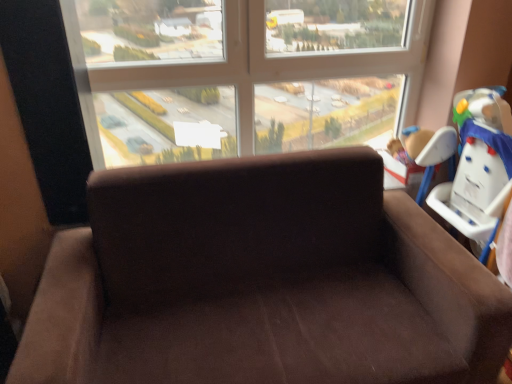
From the picture: In order to face white plastic baby carriage at right, should I rotate leftwards or rightwards?

It's best to rotate right around 27.843 degrees.

Image resolution: width=512 pixels, height=384 pixels. Identify the location of transparent glass window at upper center. (250, 66).

From the image's perspective, who appears lower, white plastic baby carriage at right or brown plush toy at upper right?

white plastic baby carriage at right appears lower in the image.

Can you confirm if white plastic baby carriage at right is positioned to the right of brown plush toy at upper right?

Yes.

Is white plastic baby carriage at right directly adjacent to brown plush toy at upper right?

No, white plastic baby carriage at right is not touching brown plush toy at upper right.

In the image, is white plastic baby carriage at right positioned in front of or behind brown plush toy at upper right?

In the image, white plastic baby carriage at right appears in front of brown plush toy at upper right.

From a real-world perspective, is suede brown couch at center physically located above or below brown plush toy at upper right?

suede brown couch at center is below brown plush toy at upper right.

Considering the positions of objects suede brown couch at center and brown plush toy at upper right in the image provided, who is more to the right, suede brown couch at center or brown plush toy at upper right?

brown plush toy at upper right.

Based on the photo, considering the sizes of suede brown couch at center and brown plush toy at upper right in the image, is suede brown couch at center wider or thinner than brown plush toy at upper right?

suede brown couch at center is wider than brown plush toy at upper right.

Is suede brown couch at center taller or shorter than brown plush toy at upper right?

Considering their sizes, suede brown couch at center has more height than brown plush toy at upper right.

From the image's perspective, would you say transparent glass window at upper center is shown under brown plush toy at upper right?

No.

Is transparent glass window at upper center with brown plush toy at upper right?

No, transparent glass window at upper center is not next to brown plush toy at upper right.

Considering the relative positions of transparent glass window at upper center and brown plush toy at upper right in the image provided, is transparent glass window at upper center to the left or to the right of brown plush toy at upper right?

In the image, transparent glass window at upper center appears on the left side of brown plush toy at upper right.

From the image's perspective, is white plastic baby carriage at right located above transparent glass window at upper center?

No, from the image's perspective, white plastic baby carriage at right is not above transparent glass window at upper center.

Based on the photo, from a real-world perspective, is white plastic baby carriage at right located beneath transparent glass window at upper center?

Yes, from a real-world perspective, white plastic baby carriage at right is under transparent glass window at upper center.

Is white plastic baby carriage at right facing away from transparent glass window at upper center?

No, white plastic baby carriage at right's orientation is not away from transparent glass window at upper center.

Between white plastic baby carriage at right and transparent glass window at upper center, which one has larger width?

transparent glass window at upper center.

Could you tell me if transparent glass window at upper center is turned towards suede brown couch at center?

Yes, transparent glass window at upper center faces towards suede brown couch at center.

In the scene shown: Is transparent glass window at upper center bigger or smaller than suede brown couch at center?

In the image, transparent glass window at upper center appears to be smaller than suede brown couch at center.

From the image's perspective, is transparent glass window at upper center below suede brown couch at center?

No, from the image's perspective, transparent glass window at upper center is not beneath suede brown couch at center.

Are transparent glass window at upper center and suede brown couch at center far apart?

No.

Which object is positioned more to the left, brown plush toy at upper right or suede brown couch at center?

Positioned to the left is suede brown couch at center.

Looking at their sizes, would you say brown plush toy at upper right is wider or thinner than suede brown couch at center?

Considering their sizes, brown plush toy at upper right looks slimmer than suede brown couch at center.

Is brown plush toy at upper right positioned far away from suede brown couch at center?

No, brown plush toy at upper right is not far from suede brown couch at center.

Would you say brown plush toy at upper right is outside suede brown couch at center?

Absolutely, brown plush toy at upper right is external to suede brown couch at center.

Considering the relative positions of suede brown couch at center and white plastic baby carriage at right in the image provided, is suede brown couch at center to the right of white plastic baby carriage at right from the viewer's perspective?

No.

Measure the distance from suede brown couch at center to white plastic baby carriage at right.

They are 24.93 inches apart.

Is suede brown couch at center bigger or smaller than white plastic baby carriage at right?

Considering their sizes, suede brown couch at center takes up more space than white plastic baby carriage at right.

The width and height of the screenshot is (512, 384). What are the coordinates of `baby carriage on the right of brown plush toy at upper right` in the screenshot? It's located at (473, 163).

There is a suede brown couch at center. What are the coordinates of `child above it (from a real-world perspective)` in the screenshot? It's located at (409, 144).

Which object lies nearer to the anchor point white plastic baby carriage at right, suede brown couch at center or transparent glass window at upper center?

The object closer to white plastic baby carriage at right is transparent glass window at upper center.

When comparing their distances from transparent glass window at upper center, does suede brown couch at center or brown plush toy at upper right seem closer?

brown plush toy at upper right is positioned closer to the anchor transparent glass window at upper center.

From the image, which object appears to be farther from transparent glass window at upper center, brown plush toy at upper right or suede brown couch at center?

The object further to transparent glass window at upper center is suede brown couch at center.

Considering their positions, is suede brown couch at center positioned further to brown plush toy at upper right than transparent glass window at upper center?

The object further to brown plush toy at upper right is suede brown couch at center.

When comparing their distances from brown plush toy at upper right, does transparent glass window at upper center or white plastic baby carriage at right seem further?

transparent glass window at upper center is positioned further to the anchor brown plush toy at upper right.

Looking at this image, looking at the image, which one is located closer to suede brown couch at center, brown plush toy at upper right or transparent glass window at upper center?

The object closer to suede brown couch at center is transparent glass window at upper center.

When comparing their distances from brown plush toy at upper right, does transparent glass window at upper center or suede brown couch at center seem closer?

The object closer to brown plush toy at upper right is transparent glass window at upper center.

Considering their positions, is brown plush toy at upper right positioned further to suede brown couch at center than white plastic baby carriage at right?

brown plush toy at upper right.

Locate an element on the screen. Image resolution: width=512 pixels, height=384 pixels. studio couch located between transparent glass window at upper center and white plastic baby carriage at right in the left-right direction is located at coordinates (261, 282).

Find the location of a particular element. The width and height of the screenshot is (512, 384). baby carriage between suede brown couch at center and brown plush toy at upper right in the front-back direction is located at coordinates (473, 163).

I want to click on window positioned between suede brown couch at center and brown plush toy at upper right from near to far, so click(x=250, y=66).

You are a GUI agent. You are given a task and a screenshot of the screen. Output one action in this format:
    pyautogui.click(x=<x>, y=<y>)
    Task: Click on the child between transparent glass window at upper center and white plastic baby carriage at right in the horizontal direction
    
    Given the screenshot: What is the action you would take?
    pyautogui.click(x=409, y=144)